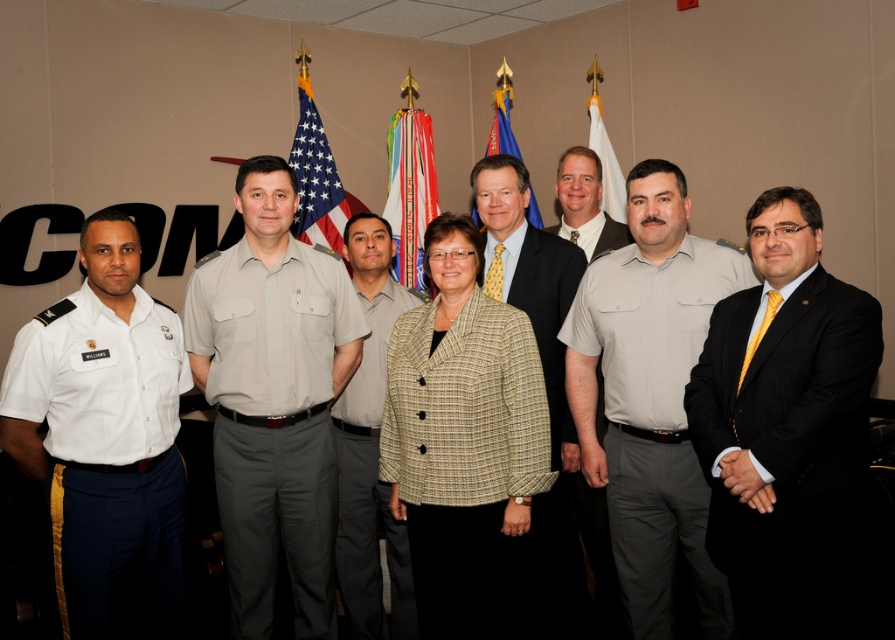
Based on the photo, you are taking a photo of the group and want to focus on two specific points in the image, point (379,234) and point (412,257). Which point should you adjust your camera focus to first if you want to ensure the closest one is sharp?

Point (379,234) is closer to the camera than point (412,257), so you should focus on point (379,234) first to ensure it is sharp.

You are a photographer adjusting the camera angle to ensure all subjects are in frame. The black pinstripe suit at right and the light gray uniform at center are partially overlapping. Which subject should you move slightly backward to avoid blocking the other?

The black pinstripe suit at right is positioned under the light gray uniform at center. To avoid blocking the light gray uniform at center, you should move the black pinstripe suit at right backward slightly.

You are organizing a group photo and need to arrange the two center individuals so that the one wearing the tan uniform at center does not block the light gray uniform at center. Based on their positions, which uniform should be placed to the side to ensure visibility?

The tan uniform at center might be wider than light gray uniform at center, so placing the tan uniform at center to the side would prevent it from blocking the light gray uniform at center.